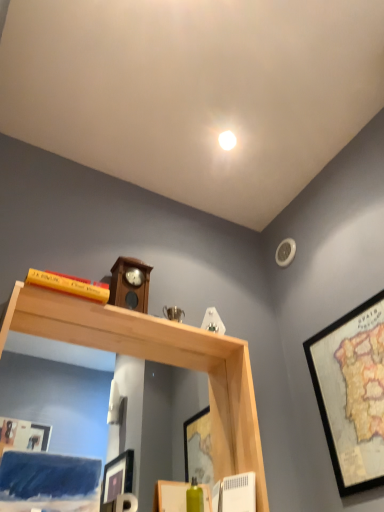
Locate an element on the screen. The width and height of the screenshot is (384, 512). vacant space underneath yellow matte bookshelf at upper left (from a real-world perspective) is located at coordinates (70, 300).